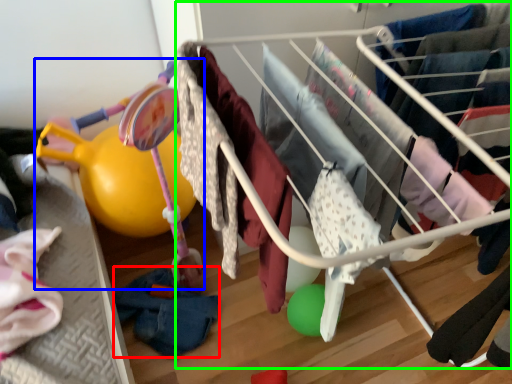
Question: Which is nearer to the clothing (highlighted by a red box)? baby carriage (highlighted by a blue box) or infant bed (highlighted by a green box).

Choices:
 (A) baby carriage
 (B) infant bed

Answer: (A)